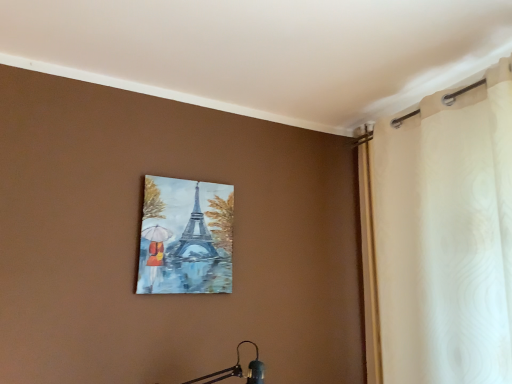
Question: Would you say white sheer curtain at upper right contains matte canvas painting of eiffel tower at upper center?

Choices:
 (A) no
 (B) yes

Answer: (A)

Question: Considering the relative sizes of white sheer curtain at upper right and matte canvas painting of eiffel tower at upper center in the image provided, is white sheer curtain at upper right thinner than matte canvas painting of eiffel tower at upper center?

Choices:
 (A) yes
 (B) no

Answer: (B)

Question: Can you confirm if white sheer curtain at upper right is shorter than matte canvas painting of eiffel tower at upper center?

Choices:
 (A) no
 (B) yes

Answer: (A)

Question: From the image's perspective, is white sheer curtain at upper right below matte canvas painting of eiffel tower at upper center?

Choices:
 (A) yes
 (B) no

Answer: (B)

Question: From the image's perspective, does white sheer curtain at upper right appear higher than matte canvas painting of eiffel tower at upper center?

Choices:
 (A) no
 (B) yes

Answer: (B)

Question: Does white sheer curtain at upper right have a larger size compared to matte canvas painting of eiffel tower at upper center?

Choices:
 (A) yes
 (B) no

Answer: (A)

Question: Is matte canvas painting of eiffel tower at upper center facing away from white sheer curtain at upper right?

Choices:
 (A) yes
 (B) no

Answer: (B)

Question: Is the depth of matte canvas painting of eiffel tower at upper center less than that of white sheer curtain at upper right?

Choices:
 (A) yes
 (B) no

Answer: (B)

Question: Is matte canvas painting of eiffel tower at upper center oriented towards white sheer curtain at upper right?

Choices:
 (A) no
 (B) yes

Answer: (A)

Question: Is matte canvas painting of eiffel tower at upper center taller than white sheer curtain at upper right?

Choices:
 (A) yes
 (B) no

Answer: (B)

Question: Considering the relative sizes of matte canvas painting of eiffel tower at upper center and white sheer curtain at upper right in the image provided, is matte canvas painting of eiffel tower at upper center shorter than white sheer curtain at upper right?

Choices:
 (A) no
 (B) yes

Answer: (B)

Question: Could white sheer curtain at upper right be considered to be inside matte canvas painting of eiffel tower at upper center?

Choices:
 (A) no
 (B) yes

Answer: (A)

Question: From a real-world perspective, relative to matte canvas painting of eiffel tower at upper center, is white sheer curtain at upper right vertically above or below?

Choices:
 (A) below
 (B) above

Answer: (A)